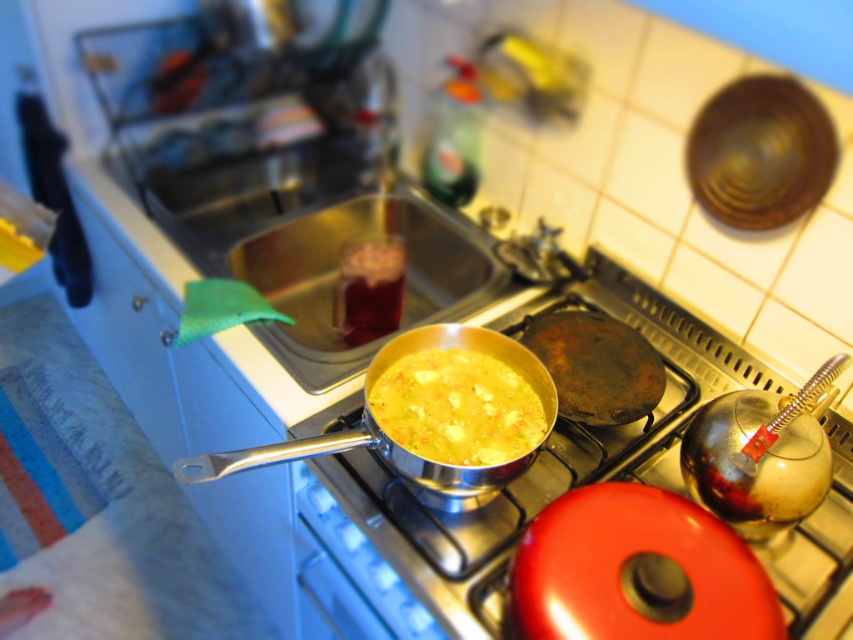
Between silver metallic pan at center and yellow matte soup at center, which one appears on the left side from the viewer's perspective?

yellow matte soup at center

Does silver metallic pan at center appear on the right side of yellow matte soup at center?

Indeed, silver metallic pan at center is positioned on the right side of yellow matte soup at center.

Is point (399, 566) positioned behind point (503, 401)?

No, it is in front of (503, 401).

At what (x,y) coordinates should I click in order to perform the action: click on silver metallic pan at center. Please return your answer as a coordinate pair (x, y). Looking at the image, I should click on (519, 476).